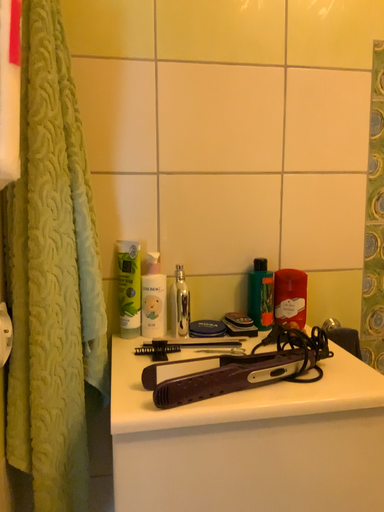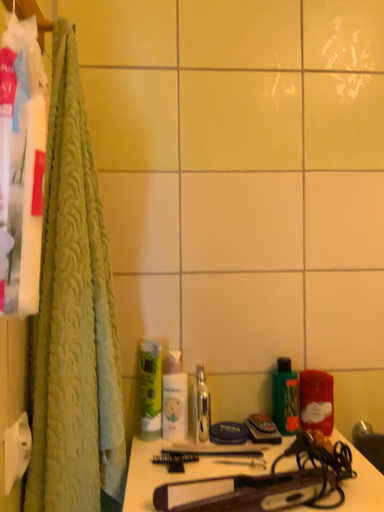
Question: Which way did the camera rotate in the video?

Choices:
 (A) rotated upward
 (B) rotated downward

Answer: (A)